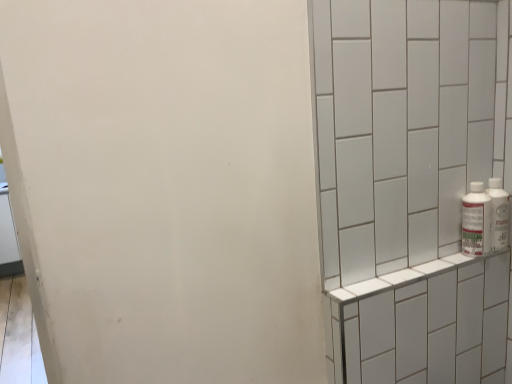
Locate an element on the screen. The height and width of the screenshot is (384, 512). white plastic bottles at right, the 1th bottle in the right-to-left sequence is located at coordinates (499, 214).

From a real-world perspective, is white tile shelf at right on top of white plastic bottle at right, the 2th bottle from the right?

Incorrect, from a real-world perspective, white tile shelf at right is lower than white plastic bottle at right, the 2th bottle from the right.

Is white tile shelf at right facing away from white plastic bottle at right, the 2th bottle from the right?

white tile shelf at right is not turned away from white plastic bottle at right, the 2th bottle from the right.

From the image's perspective, is white tile shelf at right on white plastic bottle at right, the first bottle from the left?

Incorrect, from the image's perspective, white tile shelf at right is lower than white plastic bottle at right, the first bottle from the left.

Would you consider white tile shelf at right to be distant from white plastic bottle at right, the first bottle from the left?

They are positioned close to each other.

Do you think white tile shelf at right is within white plastic bottles at right, which is counted as the second bottle, starting from the left, or outside of it?

white tile shelf at right is not inside white plastic bottles at right, which is counted as the second bottle, starting from the left, it's outside.

Who is shorter, white tile shelf at right or white plastic bottles at right, which is counted as the second bottle, starting from the left?

white plastic bottles at right, which is counted as the second bottle, starting from the left.

Does white tile shelf at right have a smaller size compared to white plastic bottles at right, the 1th bottle in the right-to-left sequence?

No, white tile shelf at right is not smaller than white plastic bottles at right, the 1th bottle in the right-to-left sequence.

Considering the positions of points (390, 282) and (495, 238), is point (390, 282) farther from camera compared to point (495, 238)?

No.

Which object is wider, white plastic bottle at right, the first bottle from the left, or white plastic bottles at right, which is counted as the second bottle, starting from the left?

white plastic bottle at right, the first bottle from the left, is wider.

From a real-world perspective, is white plastic bottle at right, the first bottle from the left, located beneath white plastic bottles at right, which is counted as the second bottle, starting from the left?

Yes, from a real-world perspective, white plastic bottle at right, the first bottle from the left, is under white plastic bottles at right, which is counted as the second bottle, starting from the left.

Is white plastic bottle at right, the first bottle from the left, in front of white plastic bottles at right, the 1th bottle in the right-to-left sequence?

Yes, the depth of white plastic bottle at right, the first bottle from the left, is less than that of white plastic bottles at right, the 1th bottle in the right-to-left sequence.

Is white plastic bottles at right, the 1th bottle in the right-to-left sequence, placed right next to white tile shelf at right?

white plastic bottles at right, the 1th bottle in the right-to-left sequence, and white tile shelf at right are clearly separated.

Image resolution: width=512 pixels, height=384 pixels. Identify the location of shelf in front of the white plastic bottles at right, which is counted as the second bottle, starting from the left. (423, 323).

Does white plastic bottles at right, which is counted as the second bottle, starting from the left, have a lesser height compared to white tile shelf at right?

Correct, white plastic bottles at right, which is counted as the second bottle, starting from the left, is not as tall as white tile shelf at right.

From a real-world perspective, between white plastic bottles at right, which is counted as the second bottle, starting from the left, and white tile shelf at right, who is vertically lower?

white tile shelf at right.

From a real-world perspective, who is located higher, white plastic bottles at right, the 1th bottle in the right-to-left sequence, or white plastic bottle at right, the 2th bottle from the right?

white plastic bottles at right, the 1th bottle in the right-to-left sequence, is physically above.

Is white plastic bottles at right, which is counted as the second bottle, starting from the left, aimed at white plastic bottle at right, the first bottle from the left?

No, white plastic bottles at right, which is counted as the second bottle, starting from the left, is not aimed at white plastic bottle at right, the first bottle from the left.

In the scene shown: Considering the relative positions of white plastic bottles at right, which is counted as the second bottle, starting from the left, and white plastic bottle at right, the first bottle from the left, in the image provided, is white plastic bottles at right, which is counted as the second bottle, starting from the left, in front of white plastic bottle at right, the first bottle from the left,?

No, white plastic bottles at right, which is counted as the second bottle, starting from the left, is behind white plastic bottle at right, the first bottle from the left.

Is white plastic bottles at right, which is counted as the second bottle, starting from the left, bigger than white plastic bottle at right, the first bottle from the left?

No.

Can you confirm if white plastic bottle at right, the first bottle from the left, is taller than white tile shelf at right?

No, white plastic bottle at right, the first bottle from the left, is not taller than white tile shelf at right.

Between white plastic bottle at right, the 2th bottle from the right, and white tile shelf at right, which one appears on the left side from the viewer's perspective?

white tile shelf at right.

Which is further, (x=474, y=206) or (x=439, y=259)?

The point (x=439, y=259) is farther from the camera.

Can white tile shelf at right be found inside white plastic bottle at right, the 2th bottle from the right?

That's incorrect, white tile shelf at right is not inside white plastic bottle at right, the 2th bottle from the right.

Image resolution: width=512 pixels, height=384 pixels. I want to click on shelf in front of the white plastic bottle at right, the 2th bottle from the right, so click(423, 323).

At what (x,y) coordinates should I click in order to perform the action: click on bottle that is the 2nd object located behind the white tile shelf at right. Please return your answer as a coordinate pair (x, y). Image resolution: width=512 pixels, height=384 pixels. Looking at the image, I should click on (499, 214).

When comparing their distances from white plastic bottle at right, the 2th bottle from the right, does white plastic bottles at right, the 1th bottle in the right-to-left sequence, or white tile shelf at right seem further?

The object further to white plastic bottle at right, the 2th bottle from the right, is white tile shelf at right.

When comparing their distances from white tile shelf at right, does white plastic bottles at right, which is counted as the second bottle, starting from the left, or white plastic bottle at right, the first bottle from the left, seem further?

The object further to white tile shelf at right is white plastic bottles at right, which is counted as the second bottle, starting from the left.

From the image, which object appears to be farther from white tile shelf at right, white plastic bottle at right, the 2th bottle from the right, or white plastic bottles at right, which is counted as the second bottle, starting from the left?

Based on the image, white plastic bottles at right, which is counted as the second bottle, starting from the left, appears to be further to white tile shelf at right.

Estimate the real-world distances between objects in this image. Which object is closer to white plastic bottle at right, the first bottle from the left, white tile shelf at right or white plastic bottles at right, the 1th bottle in the right-to-left sequence?

white plastic bottles at right, the 1th bottle in the right-to-left sequence, is closer to white plastic bottle at right, the first bottle from the left.

Looking at the image, which one is located further to white plastic bottles at right, the 1th bottle in the right-to-left sequence, white plastic bottle at right, the first bottle from the left, or white tile shelf at right?

white tile shelf at right is positioned further to the anchor white plastic bottles at right, the 1th bottle in the right-to-left sequence.

Based on the photo, from the image, which object appears to be nearer to white plastic bottles at right, which is counted as the second bottle, starting from the left, white tile shelf at right or white plastic bottle at right, the 2th bottle from the right?

white plastic bottle at right, the 2th bottle from the right, is positioned closer to the anchor white plastic bottles at right, which is counted as the second bottle, starting from the left.

Find the location of a particular element. bottle between white plastic bottles at right, which is counted as the second bottle, starting from the left, and white tile shelf at right vertically is located at coordinates (476, 221).